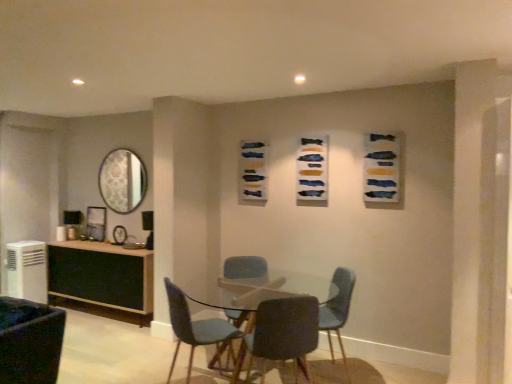
Question: From the image's perspective, is white plastic air conditioner at lower left positioned above or below clear glass table at center?

Choices:
 (A) below
 (B) above

Answer: (B)

Question: In terms of height, does white plastic air conditioner at lower left look taller or shorter compared to clear glass table at center?

Choices:
 (A) tall
 (B) short

Answer: (A)

Question: Estimate the real-world distances between objects in this image. Which object is closer to the matte blue chair at center, marked as the fifth chair in a left-to-right arrangement?

Choices:
 (A) white plastic air conditioner at lower left
 (B) velvet dark blue chair at lower left, acting as the first chair starting from the left
 (C) matte blue chair at center, the third chair from the left
 (D) matte gray chair at center, placed as the fourth chair when sorted from right to left
 (E) velvet blue chair at center, placed as the fourth chair when sorted from left to right

Answer: (E)

Question: Which object is the closest to the velvet blue chair at center, placed as the fourth chair when sorted from left to right?

Choices:
 (A) blue textured fabric at upper right, marked as the 3th art in a back-to-front arrangement
 (B) matte wood desk at left
 (C) velvet dark blue chair at lower left, acting as the first chair starting from the left
 (D) matte blue chair at center, the third chair from the left
 (E) matte blue chair at center, marked as the fifth chair in a left-to-right arrangement

Answer: (E)